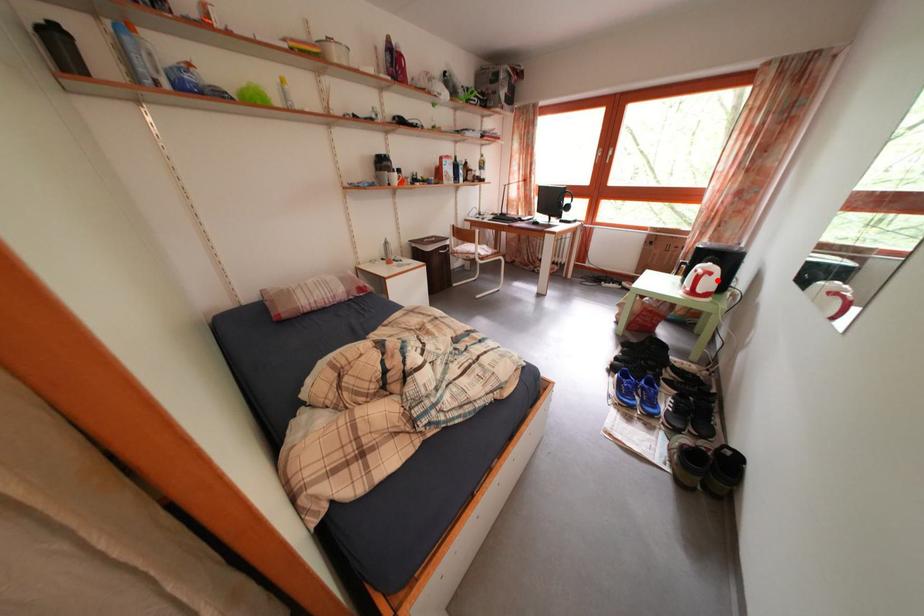
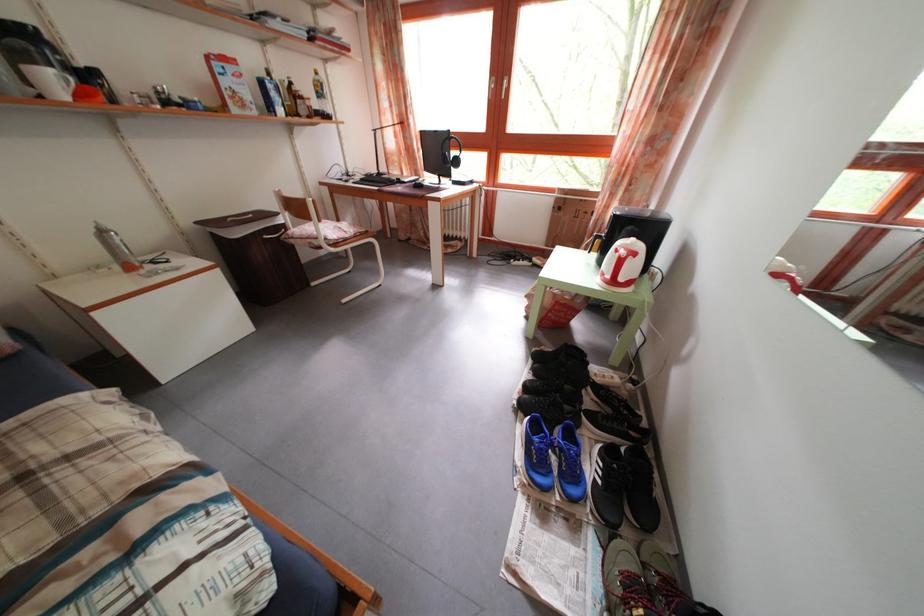
Question: I am providing you with two images of the same scene from different viewpoints. Image1 has a red point marked. In image2, the corresponding 3D location appears at what relative position? Reply with the corresponding letter.

Choices:
 (A) Closer
 (B) Farther

Answer: (B)